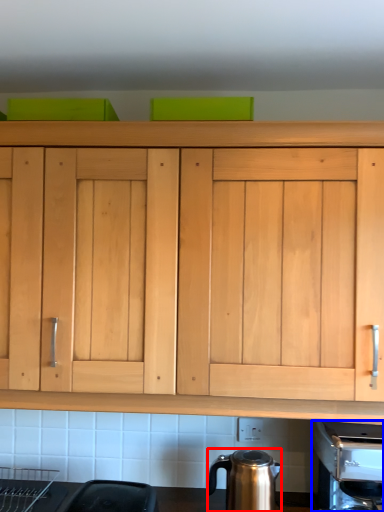
Question: Among these objects, which one is nearest to the camera, kitchen appliance (highlighted by a red box) or coffee machine (highlighted by a blue box)?

Choices:
 (A) kitchen appliance
 (B) coffee machine

Answer: (B)